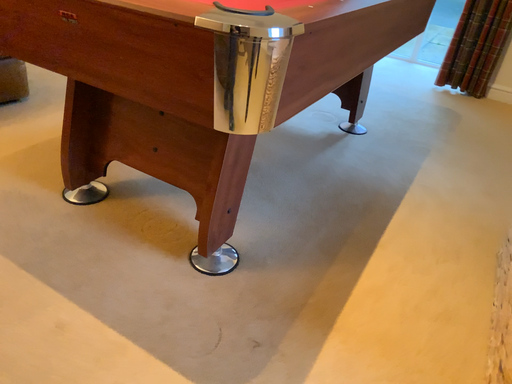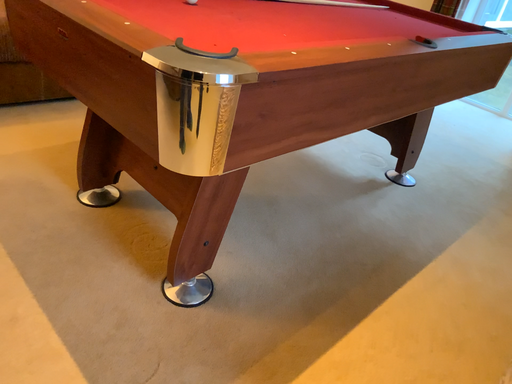
Question: Which way did the camera rotate in the video?

Choices:
 (A) rotated right
 (B) rotated left

Answer: (B)